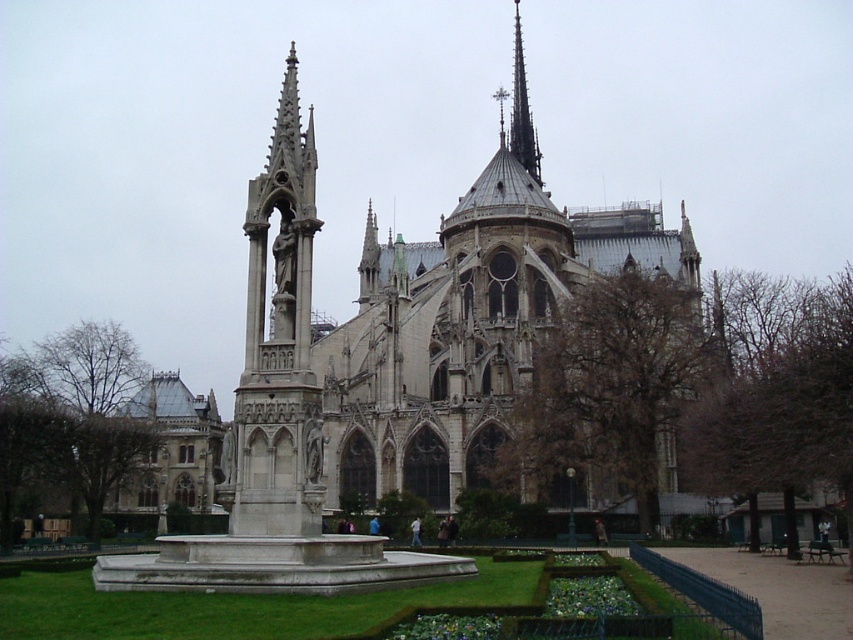
Question: Among these objects, which one is nearest to the camera?

Choices:
 (A) white stone church at center
 (B) smooth gray spire at upper center

Answer: (A)

Question: Which of the following is the farthest from the observer?

Choices:
 (A) (521, 67)
 (B) (444, 346)

Answer: (A)

Question: Does white stone church at center have a lesser width compared to smooth gray spire at upper center?

Choices:
 (A) no
 (B) yes

Answer: (A)

Question: Does white stone church at center lie in front of smooth gray spire at upper center?

Choices:
 (A) no
 (B) yes

Answer: (B)

Question: Can you confirm if white stone church at center is positioned below smooth gray spire at upper center?

Choices:
 (A) yes
 (B) no

Answer: (A)